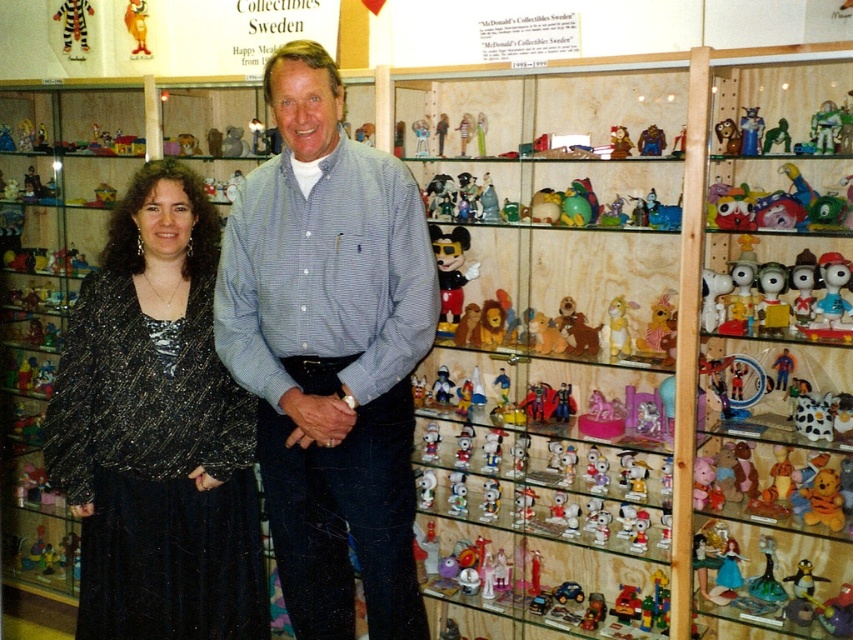
Question: Can you confirm if translucent glass toys at center is thinner than light blue striped shirt at center?

Choices:
 (A) no
 (B) yes

Answer: (A)

Question: Among these objects, which one is farthest from the camera?

Choices:
 (A) sparkly black dress at center
 (B) matte plastic toys at right
 (C) translucent plastic minnie mouse at center
 (D) light blue striped shirt at center

Answer: (C)

Question: Which point is farther to the camera?

Choices:
 (A) matte plastic peanuts at center
 (B) matte plastic toys at right
 (C) matte yellow plush rabbit at center

Answer: (C)

Question: Observing the image, what is the correct spatial positioning of light blue striped shirt at center in reference to matte plastic peanuts at center?

Choices:
 (A) left
 (B) right

Answer: (A)

Question: In this image, where is sparkly black dress at center located relative to matte plastic peanuts at center?

Choices:
 (A) right
 (B) left

Answer: (B)

Question: Which point is farther to the camera?

Choices:
 (A) (335, 356)
 (B) (519, 577)
 (C) (848, 266)

Answer: (B)